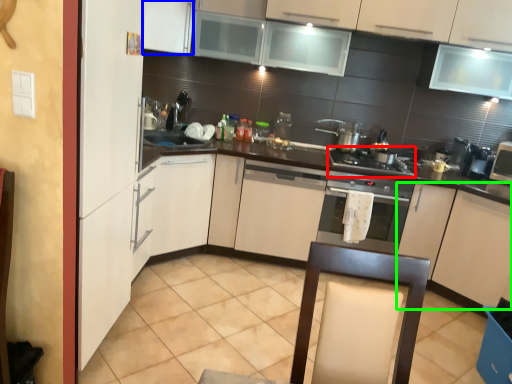
Question: Which is nearer to the gas stove (highlighted by a red box)? cabinetry (highlighted by a blue box) or cabinetry (highlighted by a green box).

Choices:
 (A) cabinetry
 (B) cabinetry

Answer: (B)